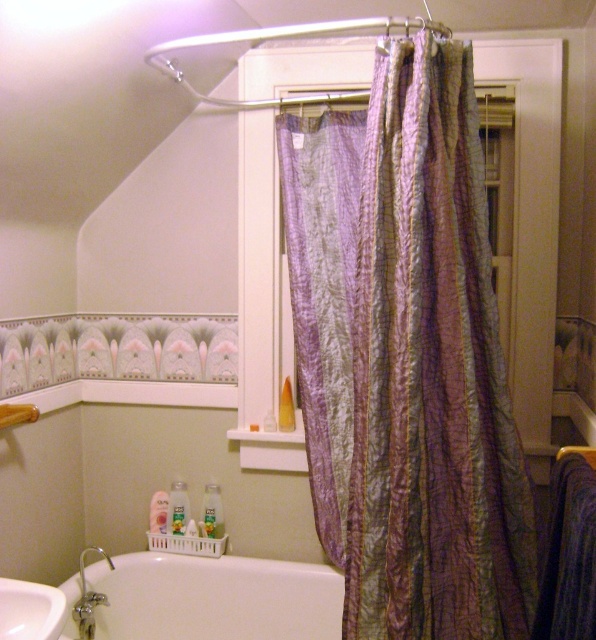
You are organizing a bathroom inventory and need to compare the sizes of two items. Which one is larger between the purple textured fabric at center and the wooden towel bar at lower left?

The purple textured fabric at center is bigger than the wooden towel bar at lower left according to the description.

You are standing in the bathroom and want to place a new towel rack. The rack needs to be installed at coordinates between 0.5 and 0.6 on the x and y axes. Is the purple textured fabric at center in the way?

The purple textured fabric at center is located at coordinates point (430,376), which falls within the specified range of 0.5 to 0.6 on both the x and y axes. Therefore, the purple textured fabric at center is in the way of installing the towel rack at those coordinates.

In the scene shown: You are standing in the bathroom and notice a point marked at coordinates (430,376). What object is located at this point?

The purple textured fabric at center is located at point (430,376).